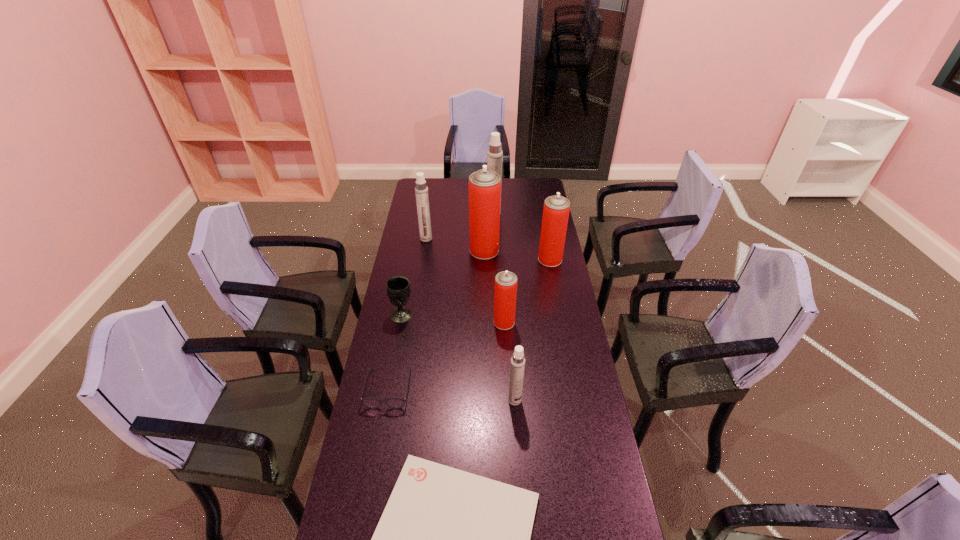
What are the coordinates of `white aerosol can that is the closest one to the chalice` in the screenshot? It's located at (421, 190).

Find the location of a particular element. The image size is (960, 540). the closest red aerosol can to the biggest red aerosol can is located at coordinates (556, 209).

Find the location of `red aerosol can that is the second closest to the shortest object`. red aerosol can that is the second closest to the shortest object is located at coordinates (556, 209).

You are a GUI agent. You are given a task and a screenshot of the screen. Output one action in this format:
    pyautogui.click(x=<x>, y=<y>)
    Task: Click on the free space that satisfies the following two spatial constraints: 1. on the back side of the rightmost object; 2. on the left side of the nearest white aerosol can
    The height and width of the screenshot is (540, 960).
    Given the screenshot: What is the action you would take?
    pyautogui.click(x=505, y=259)

You are a GUI agent. You are given a task and a screenshot of the screen. Output one action in this format:
    pyautogui.click(x=<x>, y=<y>)
    Task: Click on the free space that satisfies the following two spatial constraints: 1. on the front side of the biggest red aerosol can; 2. on the left side of the rightmost object
    
    Given the screenshot: What is the action you would take?
    pyautogui.click(x=485, y=259)

The image size is (960, 540). Find the location of `vacant space that satisfies the following two spatial constraints: 1. on the front side of the smallest white aerosol can; 2. on the right side of the biggest red aerosol can`. vacant space that satisfies the following two spatial constraints: 1. on the front side of the smallest white aerosol can; 2. on the right side of the biggest red aerosol can is located at coordinates (486, 400).

You are a GUI agent. You are given a task and a screenshot of the screen. Output one action in this format:
    pyautogui.click(x=<x>, y=<y>)
    Task: Click on the vacant space that satisfies the following two spatial constraints: 1. on the front side of the fifth farthest aerosol can; 2. on the right side of the seventh tallest object
    The height and width of the screenshot is (540, 960).
    Given the screenshot: What is the action you would take?
    pyautogui.click(x=400, y=322)

At what (x,y) coordinates should I click in order to perform the action: click on free spot that satisfies the following two spatial constraints: 1. on the back side of the farthest white aerosol can; 2. on the left side of the third shortest object. Please return your answer as a coordinate pair (x, y). Looking at the image, I should click on (420, 213).

In order to click on blank area in the image that satisfies the following two spatial constraints: 1. on the front side of the smallest white aerosol can; 2. on the right side of the biggest white aerosol can in this screenshot , I will do `click(501, 400)`.